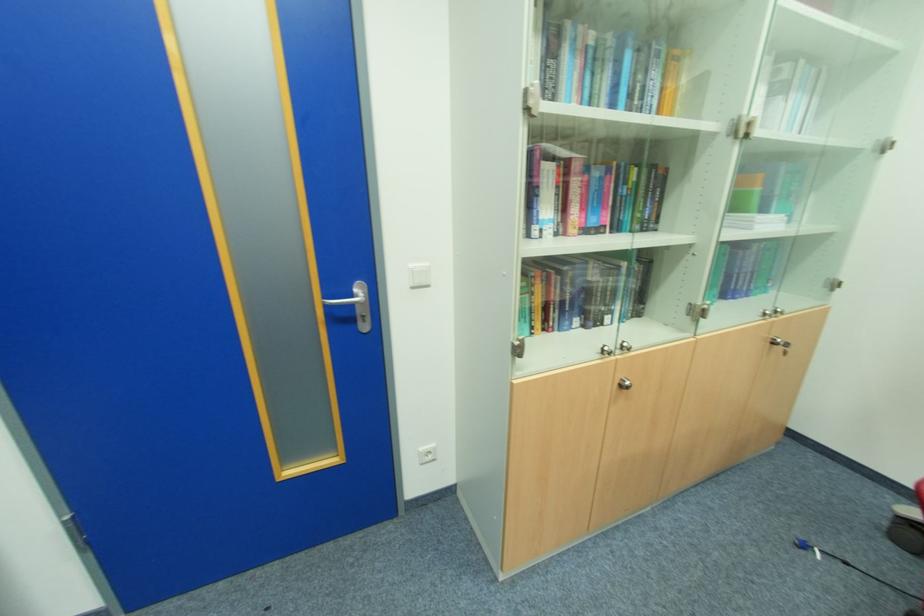
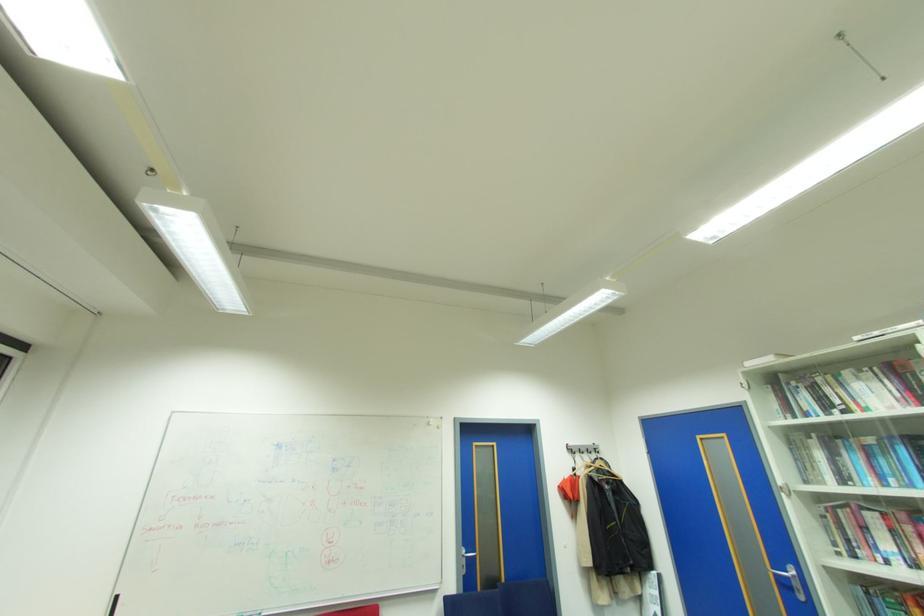
In the second image, find the point that corresponds to point 357,305 in the first image.

(791, 578)